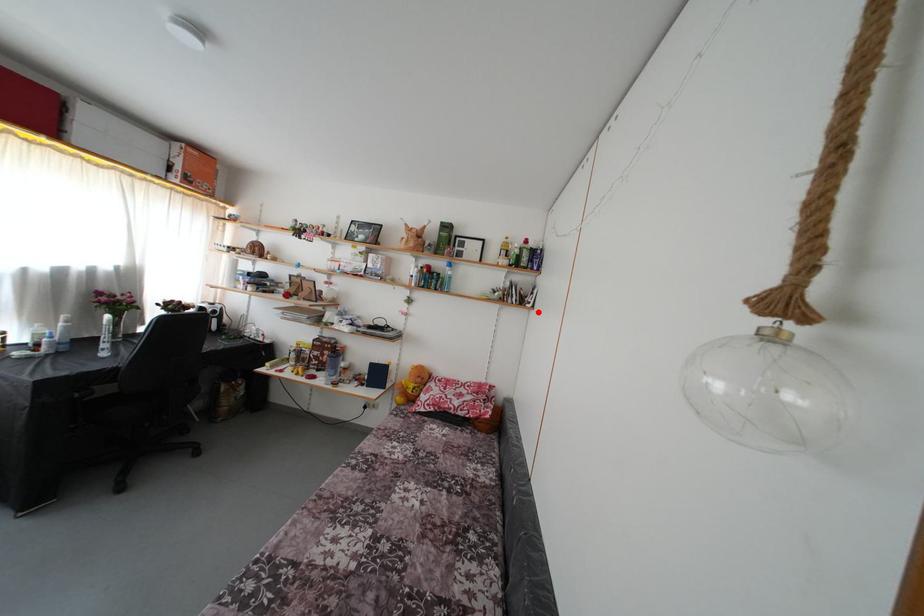
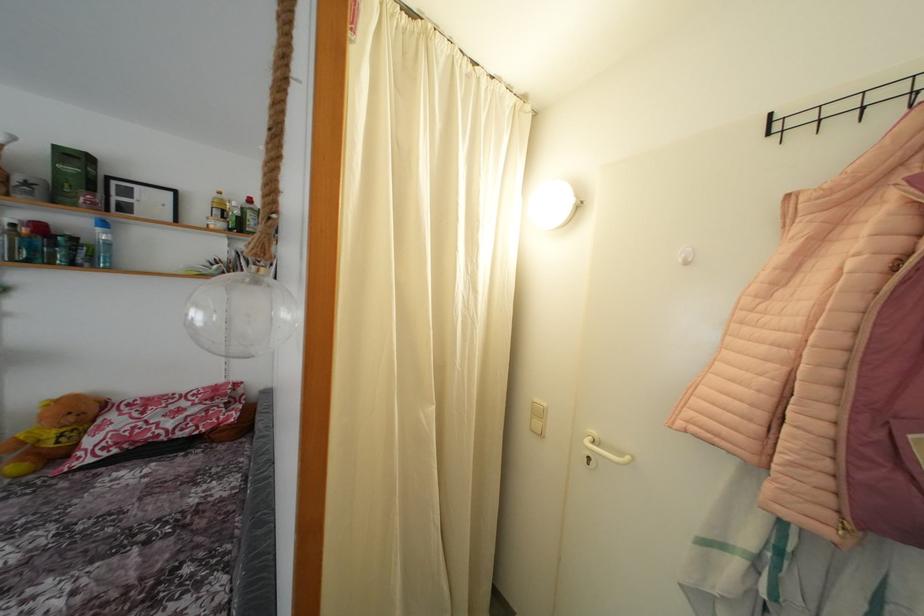
Locate, in the second image, the point that corresponds to the highlighted location in the first image.

(281, 286)